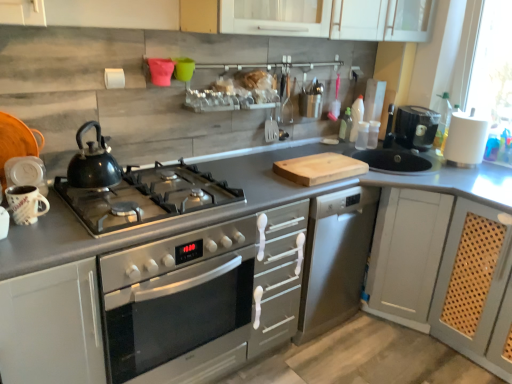
Question: From the image's perspective, would you say matte gray cabinet at right, the 1th cabinetry in the right-to-left sequence, is positioned over white matte cabinet at lower left, placed as the second cabinetry when sorted from right to left?

Choices:
 (A) yes
 (B) no

Answer: (A)

Question: Considering the relative sizes of matte gray cabinet at right, arranged as the 2th cabinetry when viewed from the left, and white matte cabinet at lower left, which is the 1th cabinetry from left to right, in the image provided, is matte gray cabinet at right, arranged as the 2th cabinetry when viewed from the left, thinner than white matte cabinet at lower left, which is the 1th cabinetry from left to right,?

Choices:
 (A) no
 (B) yes

Answer: (A)

Question: Can you confirm if matte gray cabinet at right, arranged as the 2th cabinetry when viewed from the left, is taller than white matte cabinet at lower left, placed as the second cabinetry when sorted from right to left?

Choices:
 (A) no
 (B) yes

Answer: (B)

Question: Does matte gray cabinet at right, the 1th cabinetry in the right-to-left sequence, have a smaller size compared to white matte cabinet at lower left, placed as the second cabinetry when sorted from right to left?

Choices:
 (A) no
 (B) yes

Answer: (A)

Question: Is matte gray cabinet at right, the 1th cabinetry in the right-to-left sequence, next to white matte cabinet at lower left, which is the 1th cabinetry from left to right?

Choices:
 (A) yes
 (B) no

Answer: (B)

Question: From the image's perspective, is black plastic coffee machine at right located above or below stainless steel oven at center?

Choices:
 (A) below
 (B) above

Answer: (B)

Question: In terms of size, does black plastic coffee machine at right appear bigger or smaller than stainless steel oven at center?

Choices:
 (A) small
 (B) big

Answer: (A)

Question: From a real-world perspective, relative to stainless steel oven at center, is black plastic coffee machine at right vertically above or below?

Choices:
 (A) below
 (B) above

Answer: (B)

Question: Is black plastic coffee machine at right in front of or behind stainless steel oven at center in the image?

Choices:
 (A) front
 (B) behind

Answer: (B)

Question: Is shiny black kettle at left bigger or smaller than white matte paper towel holder at upper right, positioned as the 2th appliance in front-to-back order?

Choices:
 (A) small
 (B) big

Answer: (A)

Question: Do you think shiny black kettle at left is within white matte paper towel holder at upper right, which is counted as the 1th appliance, starting from the top, or outside of it?

Choices:
 (A) inside
 (B) outside

Answer: (B)

Question: Looking at their shapes, would you say shiny black kettle at left is wider or thinner than white matte paper towel holder at upper right, arranged as the 2th appliance when ordered from the bottom?

Choices:
 (A) thin
 (B) wide

Answer: (A)

Question: Relative to white matte paper towel holder at upper right, arranged as the 2th appliance when ordered from the bottom, is shiny black kettle at left in front or behind?

Choices:
 (A) behind
 (B) front

Answer: (B)

Question: Considering the positions of shiny black kettle at left and matte gray cabinet at right, the 1th cabinetry in the right-to-left sequence, in the image, is shiny black kettle at left wider or thinner than matte gray cabinet at right, the 1th cabinetry in the right-to-left sequence,?

Choices:
 (A) wide
 (B) thin

Answer: (B)

Question: In the image, is shiny black kettle at left on the left side or the right side of matte gray cabinet at right, arranged as the 2th cabinetry when viewed from the left?

Choices:
 (A) right
 (B) left

Answer: (B)